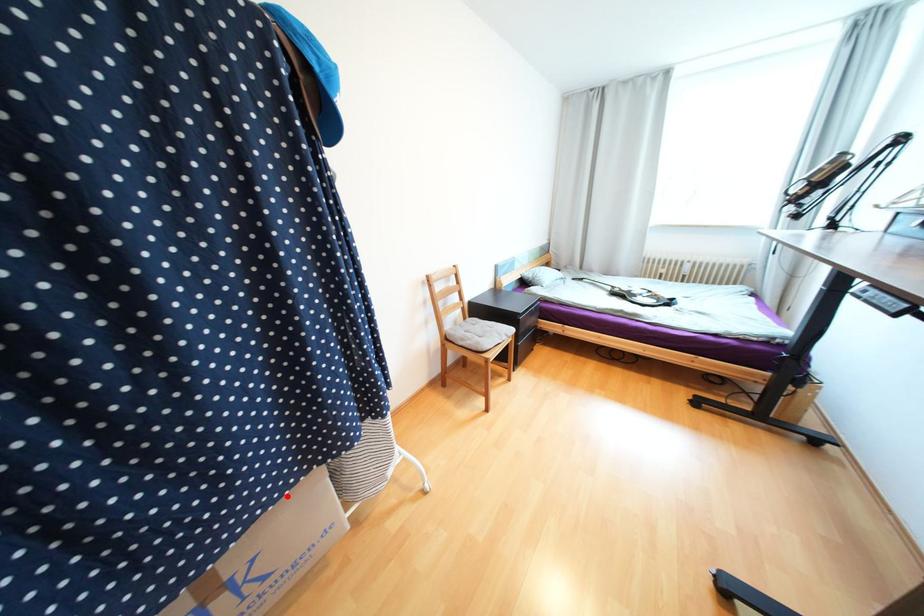
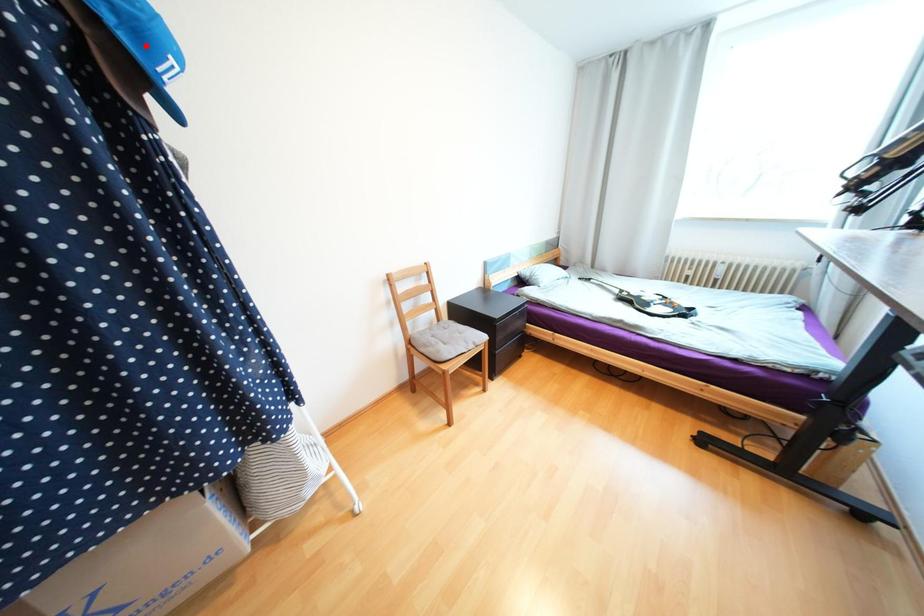
I am providing you with two images of the same scene from different viewpoints. A red point is marked on the first image and another point is marked on the second image. Does the point marked in image1 correspond to the same location as the one in image2?

No